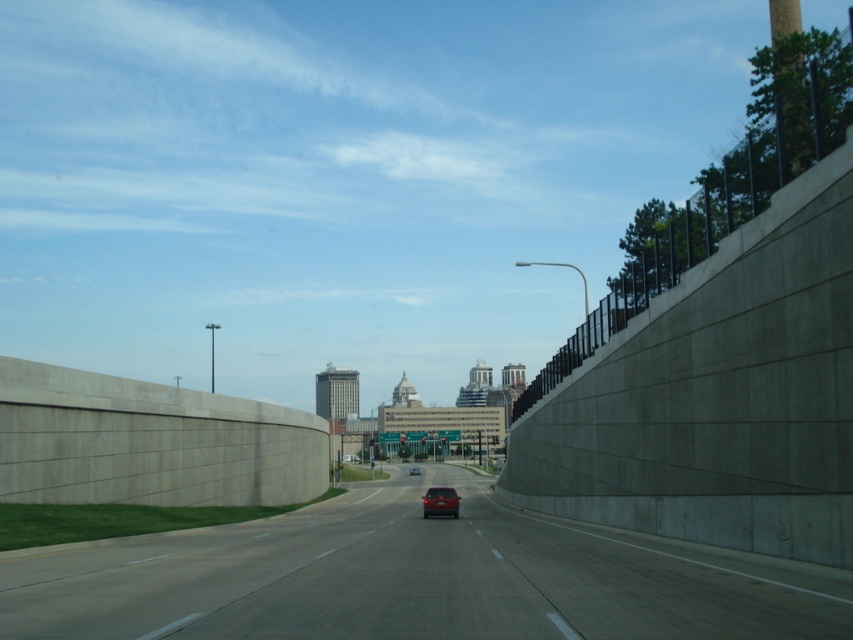
Question: Considering the real-world distances, which object is farthest from the smooth asphalt highway at center?

Choices:
 (A) shiny red sedan at center
 (B) matte red car at center

Answer: (B)

Question: Is the position of smooth asphalt highway at center less distant than that of shiny red sedan at center?

Choices:
 (A) yes
 (B) no

Answer: (A)

Question: Which is nearer to the shiny red sedan at center?

Choices:
 (A) smooth asphalt highway at center
 (B) matte red car at center

Answer: (A)

Question: Which point is closer to the camera?

Choices:
 (A) smooth asphalt highway at center
 (B) shiny red sedan at center
 (C) matte red car at center

Answer: (A)

Question: Is shiny red sedan at center above matte red car at center?

Choices:
 (A) yes
 (B) no

Answer: (A)

Question: Is smooth asphalt highway at center below shiny red sedan at center?

Choices:
 (A) yes
 (B) no

Answer: (A)